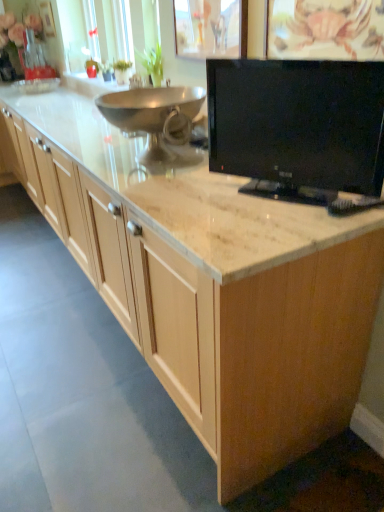
Locate an element on the screen. blank space to the left of black glossy tv at upper right is located at coordinates (201, 207).